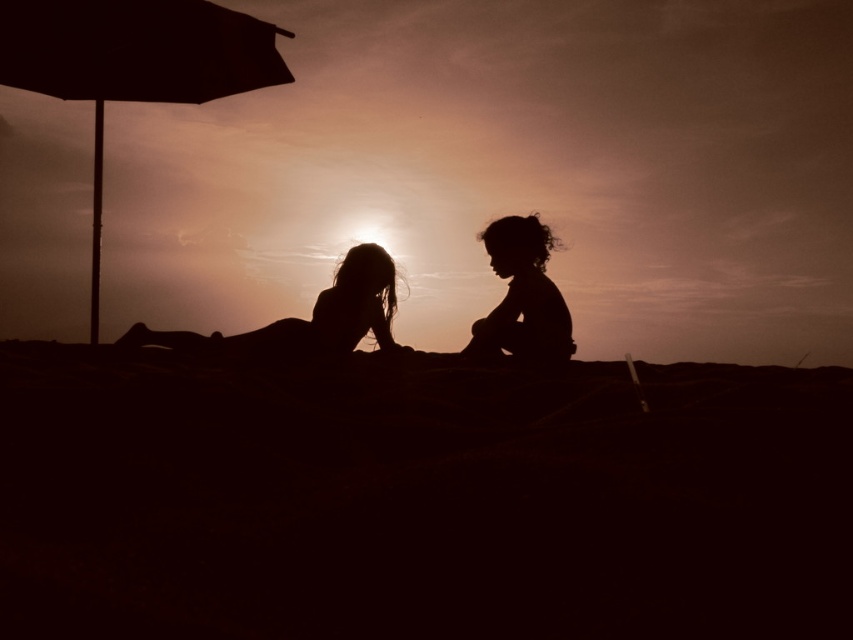
Does matte black umbrella at left appear over silhouette children at center?

Correct, matte black umbrella at left is located above silhouette children at center.

Which is behind, point (107, 58) or point (337, 337)?

The point (337, 337) is more distant.

Find the location of a particular element. This screenshot has width=853, height=640. matte black umbrella at left is located at coordinates (132, 61).

Based on the photo, who is more forward, (184, 24) or (379, 328)?

Point (184, 24)

Who is higher up, matte black umbrella at left or silhouette figure at center?

matte black umbrella at left

Is point (90, 74) closer to viewer compared to point (283, 342)?

No.

The image size is (853, 640). What are the coordinates of `matte black umbrella at left` in the screenshot? It's located at (132, 61).

Does matte black umbrella at left appear on the right side of silhouette child at center?

No, matte black umbrella at left is not to the right of silhouette child at center.

Who is positioned more to the right, matte black umbrella at left or silhouette child at center?

From the viewer's perspective, silhouette child at center appears more on the right side.

Is point (193, 38) farther from camera compared to point (524, 326)?

No, (193, 38) is in front of (524, 326).

You are a GUI agent. You are given a task and a screenshot of the screen. Output one action in this format:
    pyautogui.click(x=<x>, y=<y>)
    Task: Click on the matte black umbrella at left
    Image resolution: width=853 pixels, height=640 pixels.
    Given the screenshot: What is the action you would take?
    pyautogui.click(x=132, y=61)